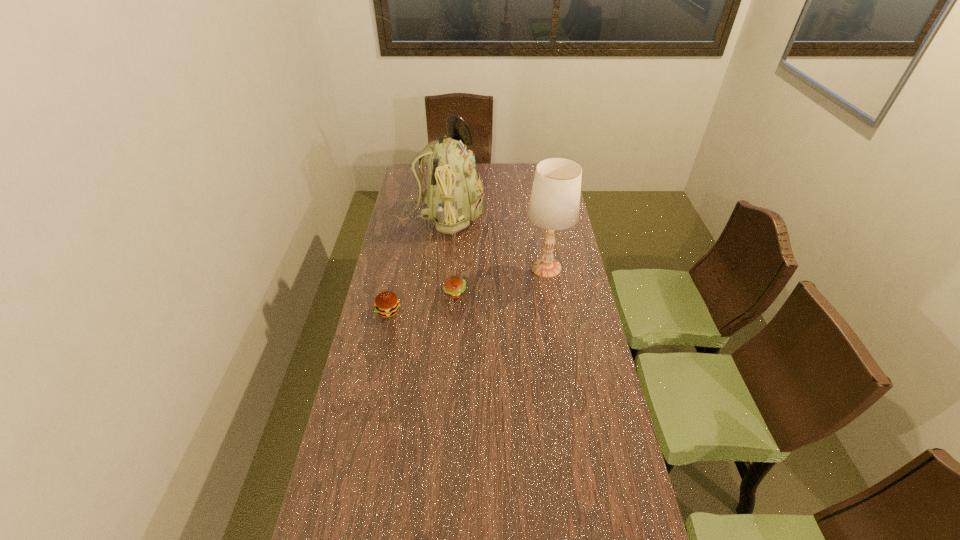
You are a GUI agent. You are given a task and a screenshot of the screen. Output one action in this format:
    pyautogui.click(x=<x>, y=<y>)
    Task: Click on the free space located on the back of the right hamburger
    Image resolution: width=960 pixels, height=540 pixels.
    Given the screenshot: What is the action you would take?
    pyautogui.click(x=456, y=274)

Where is `backpack positioned at the left edge`? This screenshot has width=960, height=540. backpack positioned at the left edge is located at coordinates (454, 195).

Identify the location of hamburger at the left edge. The width and height of the screenshot is (960, 540). (386, 304).

Where is `object present at the right edge`? This screenshot has width=960, height=540. object present at the right edge is located at coordinates (554, 204).

Image resolution: width=960 pixels, height=540 pixels. I want to click on vacant area at the far edge of the desktop, so (502, 165).

The image size is (960, 540). What are the coordinates of `blank area at the left edge` in the screenshot? It's located at (401, 313).

At what (x,y) coordinates should I click in order to perform the action: click on vacant region at the right edge of the desktop. Please return your answer as a coordinate pair (x, y). The width and height of the screenshot is (960, 540). Looking at the image, I should click on (568, 391).

Identify the location of vacant space that's between the second nearest object and the lamp. (500, 280).

Image resolution: width=960 pixels, height=540 pixels. I want to click on vacant region between the third nearest object and the backpack, so click(493, 242).

You are a GUI agent. You are given a task and a screenshot of the screen. Output one action in this format:
    pyautogui.click(x=<x>, y=<y>)
    Task: Click on the vacant space that is in between the shorter hamburger and the rightmost object
    The height and width of the screenshot is (540, 960).
    Given the screenshot: What is the action you would take?
    pyautogui.click(x=500, y=280)